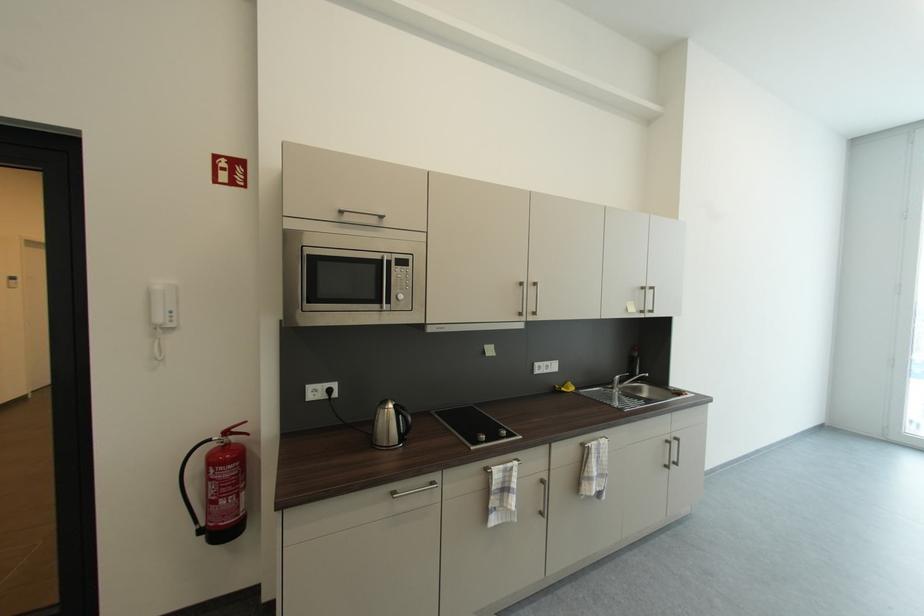
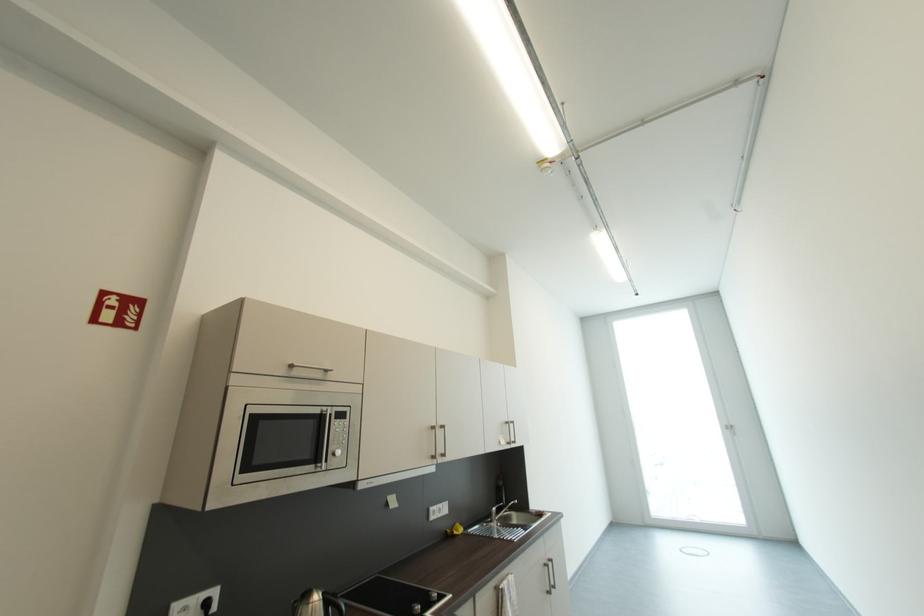
Find the pixel in the second image that matches the point at 617,387 in the first image.

(495, 522)